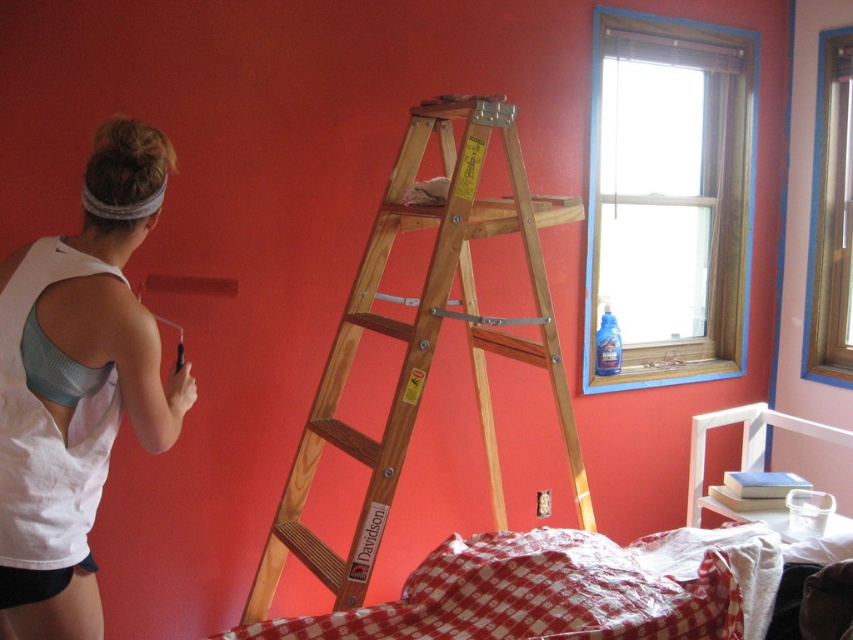
You are a painter who needs to carry both the wooden ladder at center and the red checkered fabric at center through a narrow doorway. Which item should you carry first to ensure it fits through the doorway?

The wooden ladder at center is thinner than the red checkered fabric at center, so you should carry the red checkered fabric at center first to ensure it fits through the narrow doorway.

You are standing at the center of the room and want to reach the window with a light blue frame on the right. Is the wooden ladder at center in your way?

The wooden ladder at center is located at point (424,340), which is near the center of the room. Since you are also at the center, the ladder is directly in your path towards the window on the right. You will need to move the ladder or go around it to reach the window.